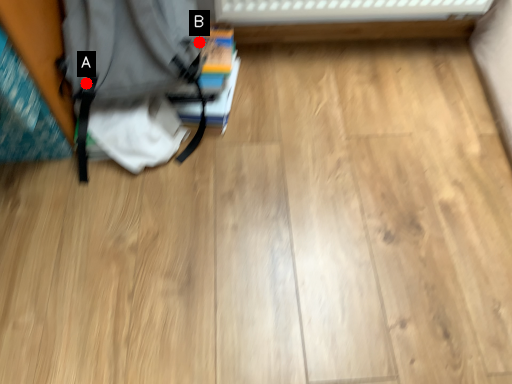
Question: Two points are circled on the image, labeled by A and B beside each circle. Among these points, which one is nearest to the camera?

Choices:
 (A) A is closer
 (B) B is closer

Answer: (A)